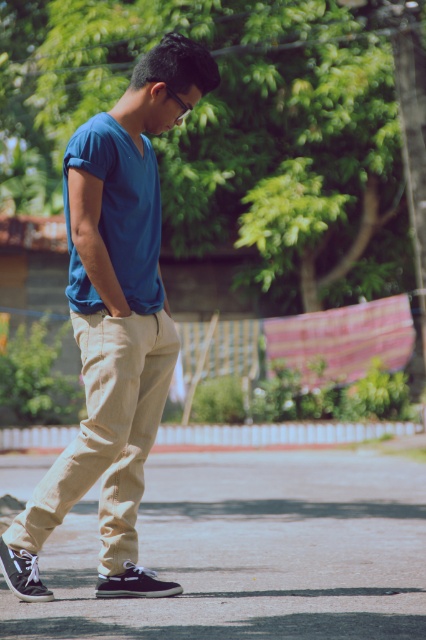
Question: Which of the following is the closest to the observer?

Choices:
 (A) matte asphalt pavement at lower center
 (B) matte blue shirt at center

Answer: (A)

Question: Which of the following is the farthest from the observer?

Choices:
 (A) matte asphalt pavement at lower center
 (B) matte blue shirt at center

Answer: (B)

Question: From the image, what is the correct spatial relationship of matte asphalt pavement at lower center in relation to matte blue shirt at center?

Choices:
 (A) below
 (B) above

Answer: (A)

Question: Which of the following is the farthest from the observer?

Choices:
 (A) matte blue shirt at center
 (B) matte asphalt pavement at lower center

Answer: (A)

Question: Does matte asphalt pavement at lower center appear under matte blue shirt at center?

Choices:
 (A) no
 (B) yes

Answer: (B)

Question: Can you confirm if matte asphalt pavement at lower center is bigger than matte blue shirt at center?

Choices:
 (A) no
 (B) yes

Answer: (B)